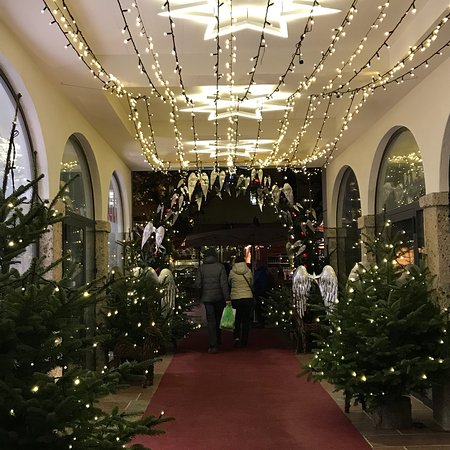
Locate an element on the screen. The width and height of the screenshot is (450, 450). red carpet is located at coordinates (249, 424).